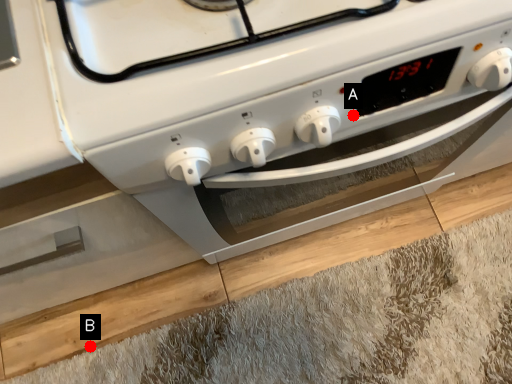
Question: Two points are circled on the image, labeled by A and B beside each circle. Which point is farther to the camera?

Choices:
 (A) A is further
 (B) B is further

Answer: (B)